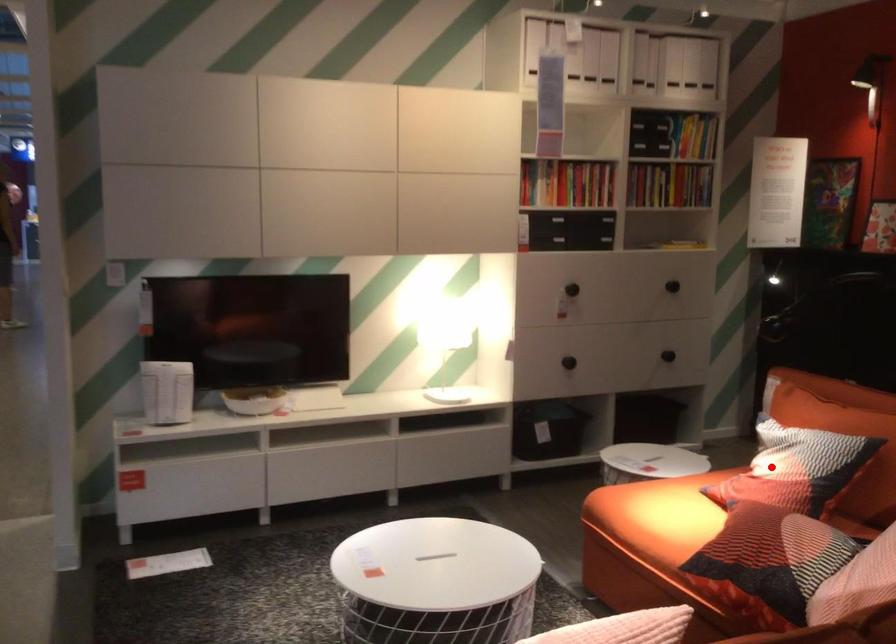
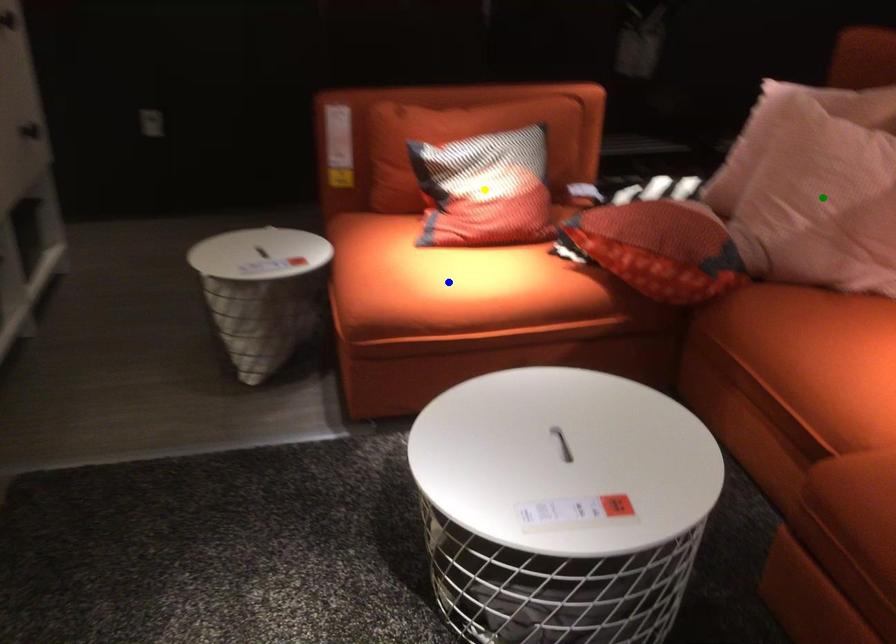
Question: I am providing you with two images of the same scene from different viewpoints. A red point is marked on the first image. You are given multiple points on the second image. Can you choose the point in image 2 that corresponds to the point in image 1?

Choices:
 (A) green point
 (B) yellow point
 (C) blue point

Answer: (B)